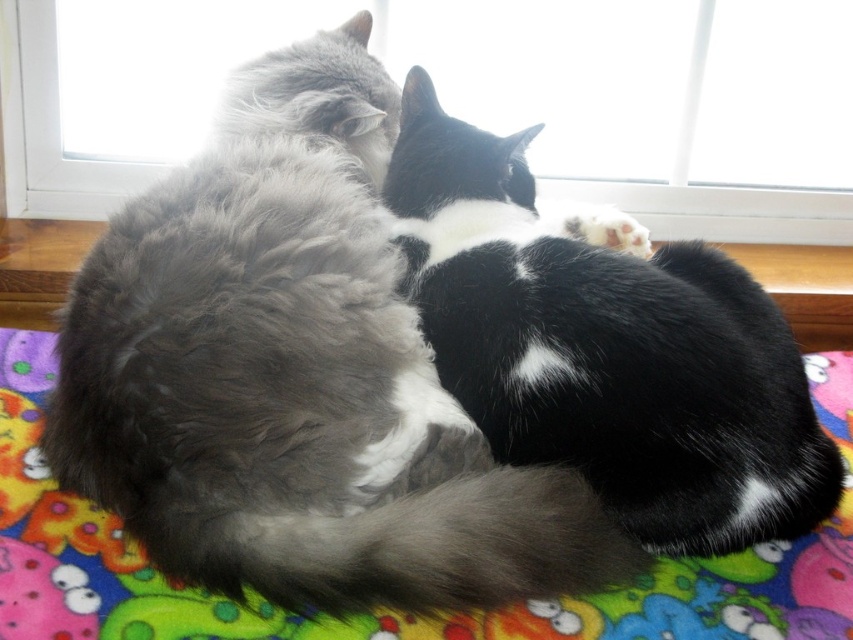
Does transparent glass window at upper center have a greater height compared to black and white fur cat at center?

No.

The image size is (853, 640). What do you see at coordinates (471, 97) in the screenshot?
I see `transparent glass window at upper center` at bounding box center [471, 97].

Is point (152, 84) less distant than point (637, 276)?

No.

Locate an element on the screen. The image size is (853, 640). transparent glass window at upper center is located at coordinates click(471, 97).

Is black and white fur cat at center smaller than multicolored fleece blanket at center?

Indeed, black and white fur cat at center has a smaller size compared to multicolored fleece blanket at center.

In the scene shown: Between black and white fur cat at center and multicolored fleece blanket at center, which one has more height?

Standing taller between the two is black and white fur cat at center.

Image resolution: width=853 pixels, height=640 pixels. Describe the element at coordinates (606, 349) in the screenshot. I see `black and white fur cat at center` at that location.

I want to click on black and white fur cat at center, so click(606, 349).

Measure the distance between fluffy gray cat at center and camera.

fluffy gray cat at center is 1.10 meters from camera.

Can you confirm if fluffy gray cat at center is positioned below wooden window sill at center?

Yes.

Where is `fluffy gray cat at center`? The width and height of the screenshot is (853, 640). fluffy gray cat at center is located at coordinates (297, 376).

The width and height of the screenshot is (853, 640). Identify the location of fluffy gray cat at center. (297, 376).